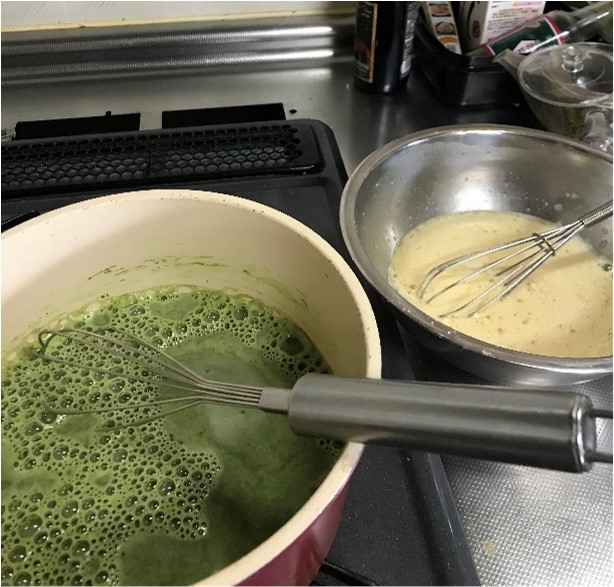
Identify the location of handles. The height and width of the screenshot is (587, 614). (481, 435), (602, 211).